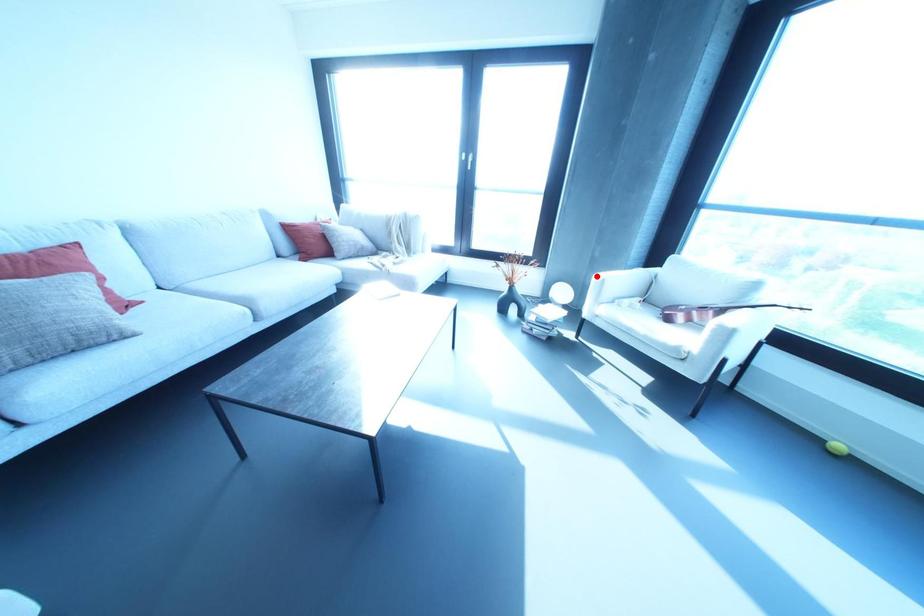
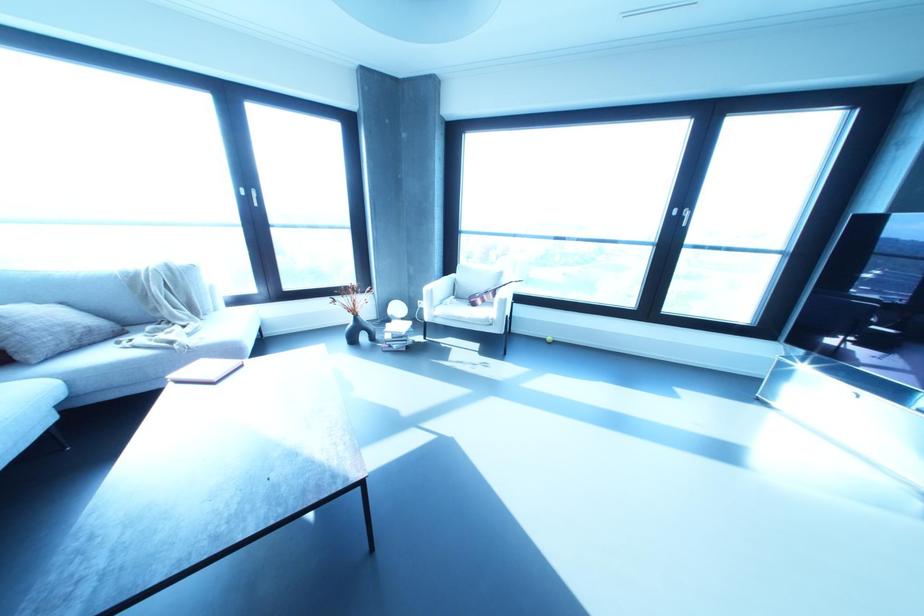
Question: A red point is marked in image1. In image2, is the corresponding 3D point closer to the camera or farther? Reply with the corresponding letter.

Choices:
 (A) The corresponding 3D point is closer.
 (B) The corresponding 3D point is farther.

Answer: (B)